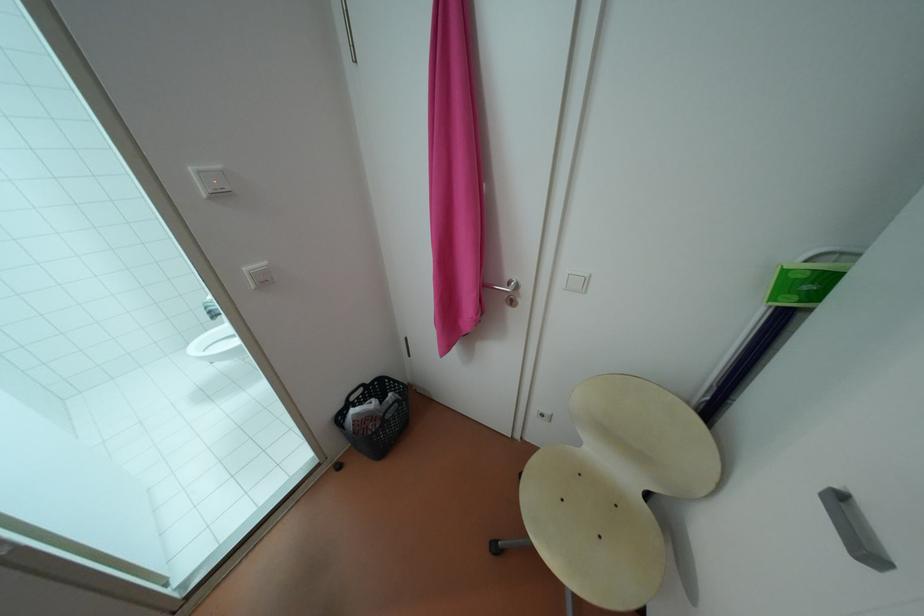
This screenshot has width=924, height=616. Describe the element at coordinates (842, 520) in the screenshot. I see `a grey cabinet handle` at that location.